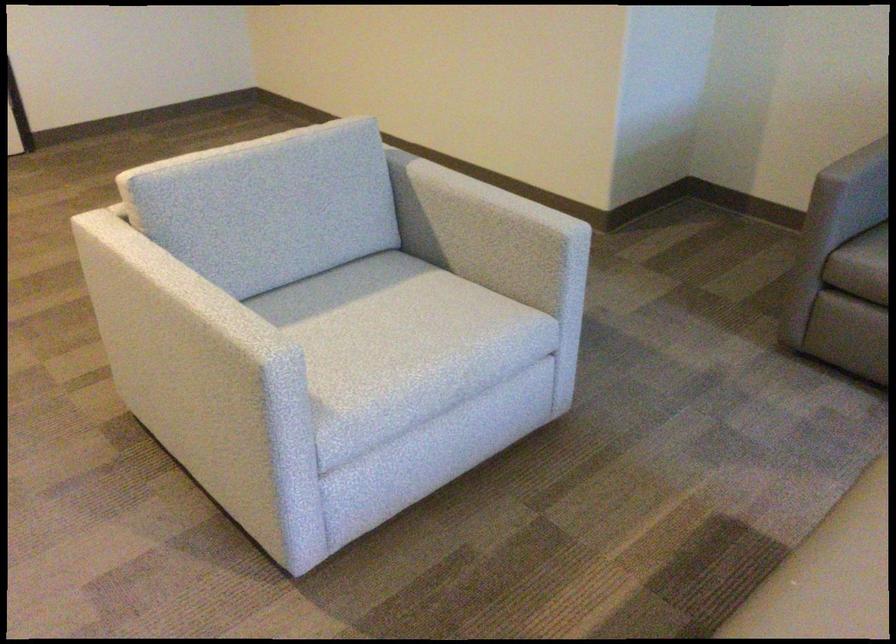
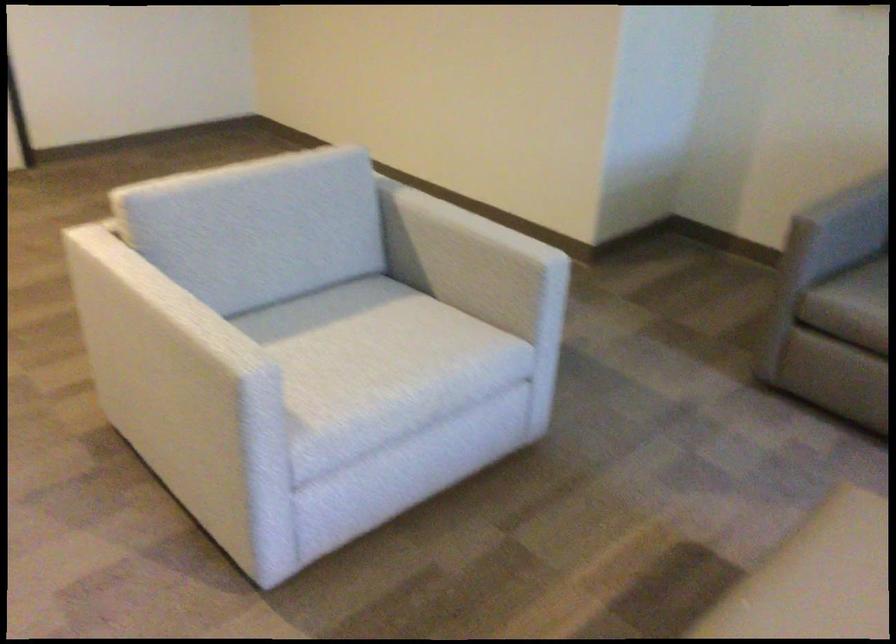
Which direction would the cameraman need to move to produce the second image?

The cameraman moved toward right, backward.